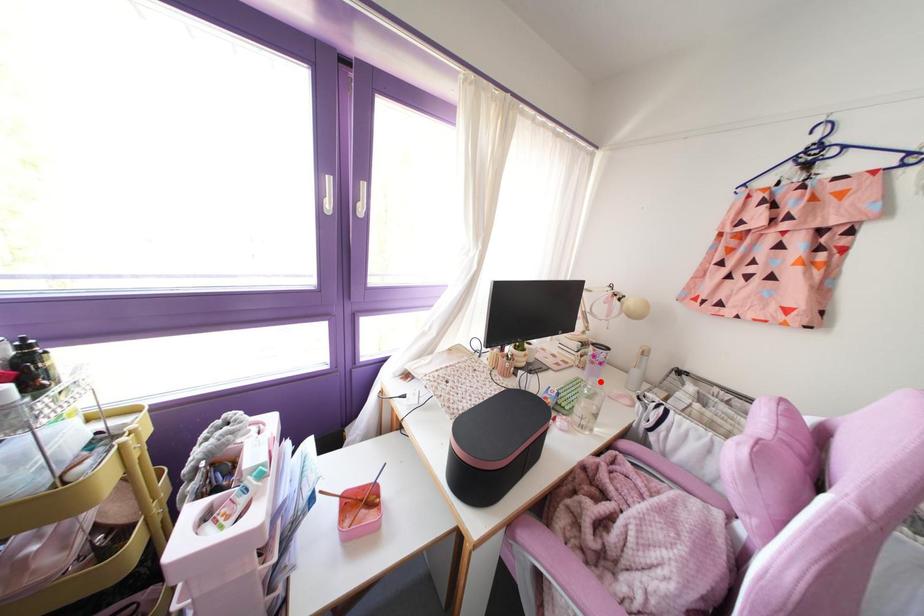
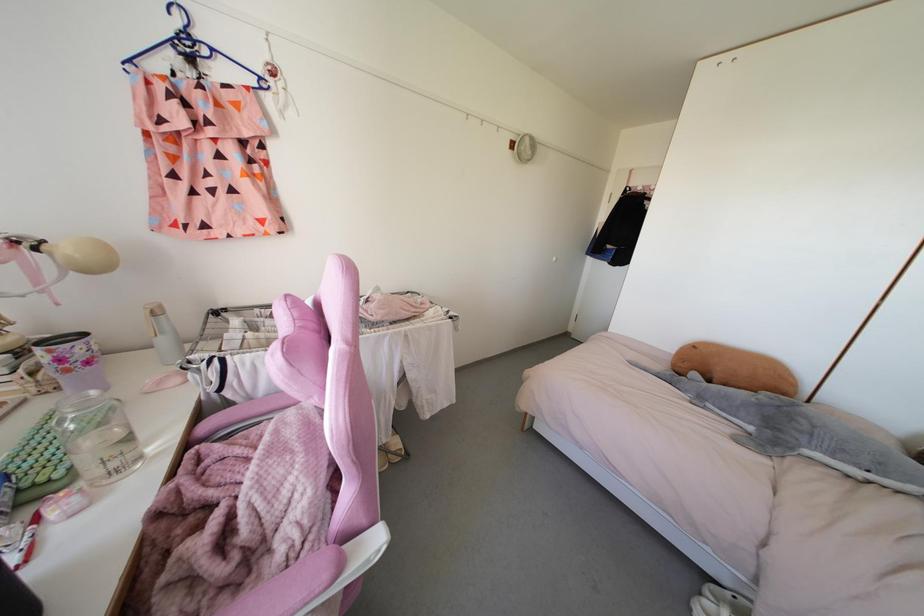
Locate, in the second image, the point that corresponds to the highlighted location in the first image.

(92, 392)